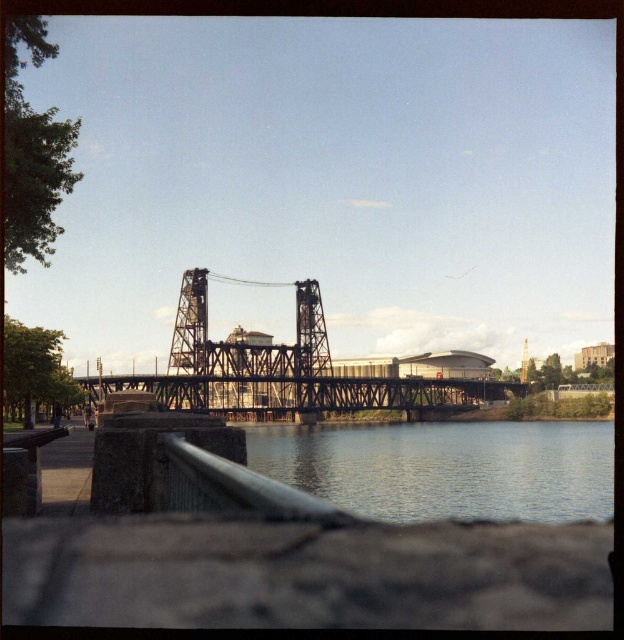
You are standing on the riverside and want to cross the river to the other side. The metallic steel bridge at center is your only option. Is the clear water at lower center directly underneath the bridge, making it possible to walk on the bridge to cross?

The clear water at lower center is positioned under the metallic steel bridge at center, so yes, the water is directly underneath the bridge. Therefore, you can safely walk across the metallic steel bridge at center to reach the other side without getting into the water.

You are standing at the center of the image and want to locate the black steel suspension bridge at center. What are the coordinates of its position?

The coordinates of the black steel suspension bridge at center are at point (285, 369).

You are standing on the riverside and see the clear water at lower center and the black steel suspension bridge at center. Which object is closer to the ground?

Result: The clear water at lower center is closer to the ground because it is located below the black steel suspension bridge at center.